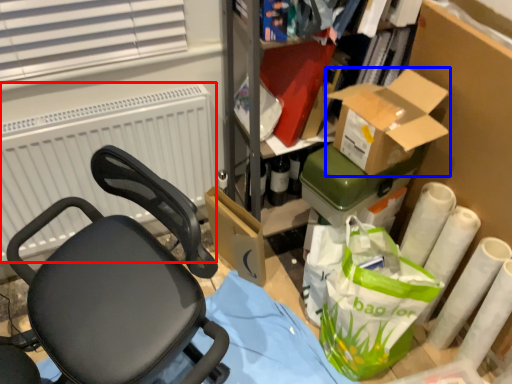
Question: Which of the following is the closest to the observer, radiator (highlighted by a red box) or box (highlighted by a blue box)?

Choices:
 (A) radiator
 (B) box

Answer: (B)